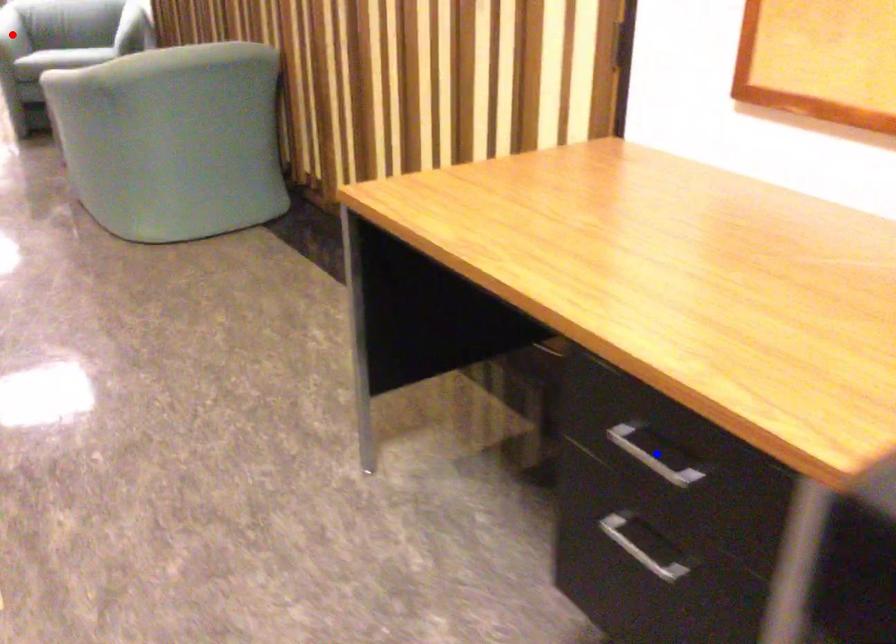
Question: In the image, two points are highlighted. Which point is nearer to the camera? Reply with the corresponding letter.

Choices:
 (A) blue point
 (B) red point

Answer: (A)